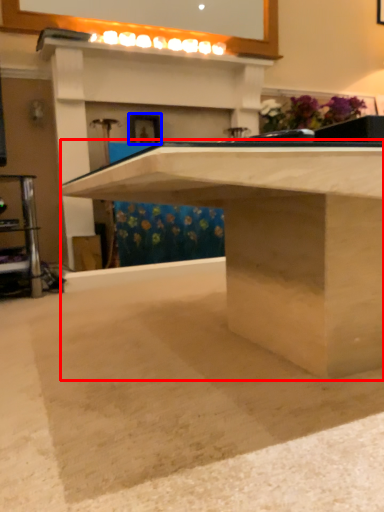
Question: Which of the following is the farthest to the observer, table (highlighted by a red box) or picture frame (highlighted by a blue box)?

Choices:
 (A) table
 (B) picture frame

Answer: (B)